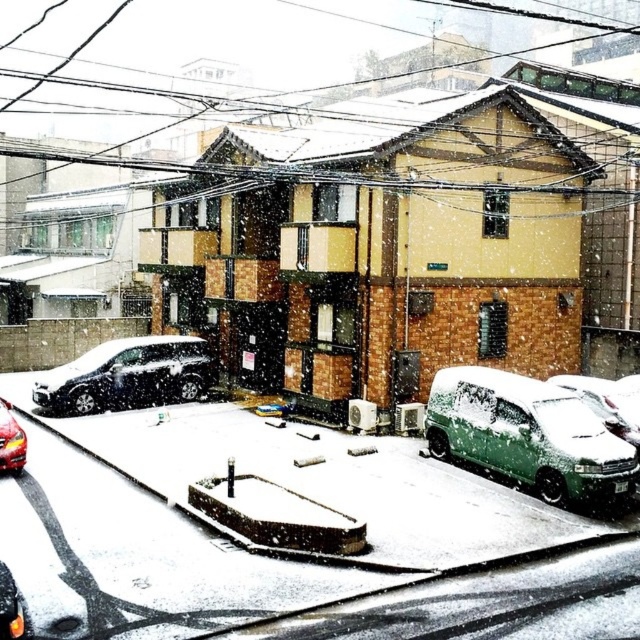
Does green matte van at right appear over shiny red car at lower left?

Correct, green matte van at right is located above shiny red car at lower left.

Does point (588, 497) lie behind point (19, 458)?

No, it is not.

Identify the location of green matte van at right. This screenshot has height=640, width=640. (529, 436).

Which of these two, shiny black sedan at left or green matte van at lower right, stands taller?

With more height is green matte van at lower right.

Does shiny black sedan at left have a greater height compared to green matte van at lower right?

No, shiny black sedan at left is not taller than green matte van at lower right.

At what (x,y) coordinates should I click in order to perform the action: click on shiny black sedan at left. Please return your answer as a coordinate pair (x, y). The width and height of the screenshot is (640, 640). Looking at the image, I should click on (128, 376).

Locate an element on the screen. shiny black sedan at left is located at coordinates (128, 376).

Who is shorter, green matte van at right or green matte van at lower right?

green matte van at lower right

Is green matte van at right taller than green matte van at lower right?

Correct, green matte van at right is much taller as green matte van at lower right.

Does point (513, 392) lie behind point (620, 390)?

No, it is not.

At what (x,y) coordinates should I click in order to perform the action: click on green matte van at right. Please return your answer as a coordinate pair (x, y). Image resolution: width=640 pixels, height=640 pixels. Looking at the image, I should click on (529, 436).